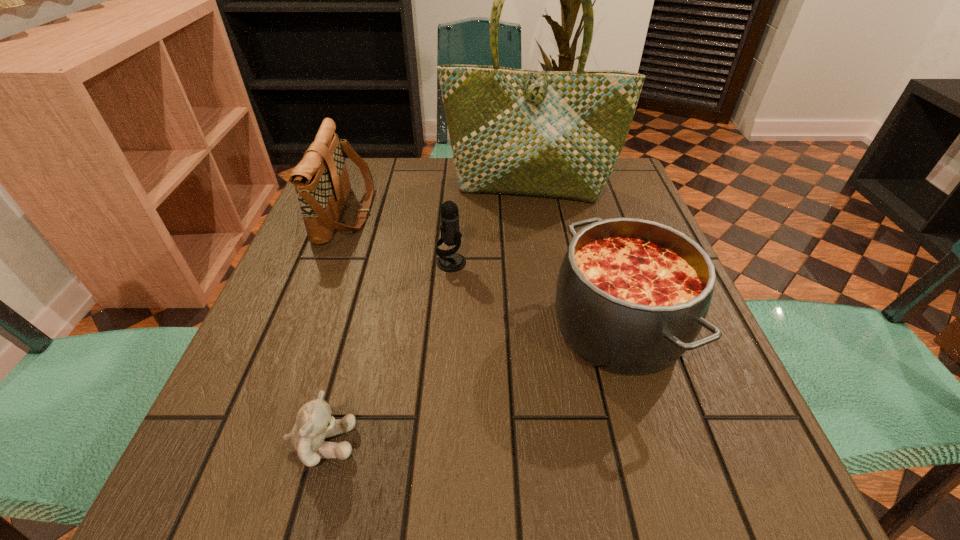
Identify the location of the tallest object. (559, 134).

Image resolution: width=960 pixels, height=540 pixels. Identify the location of shoulder bag. (321, 181).

Where is `casserole`? This screenshot has height=540, width=960. casserole is located at coordinates (632, 295).

Locate an element on the screen. This screenshot has width=960, height=540. microphone is located at coordinates (449, 261).

This screenshot has height=540, width=960. What are the coordinates of `the shortest object` in the screenshot? It's located at (314, 422).

Identify the location of the nearest object. The image size is (960, 540). (314, 422).

Identify the location of free location located on the front of the tallest object. (544, 293).

The image size is (960, 540). In order to click on vacant space located 0.050m on the front-facing side of the shoulder bag in this screenshot , I will do `click(391, 213)`.

Locate an element on the screen. blank space located on the left of the casserole is located at coordinates (471, 328).

Identify the location of blank space located on the left of the microphone. The width and height of the screenshot is (960, 540). (387, 263).